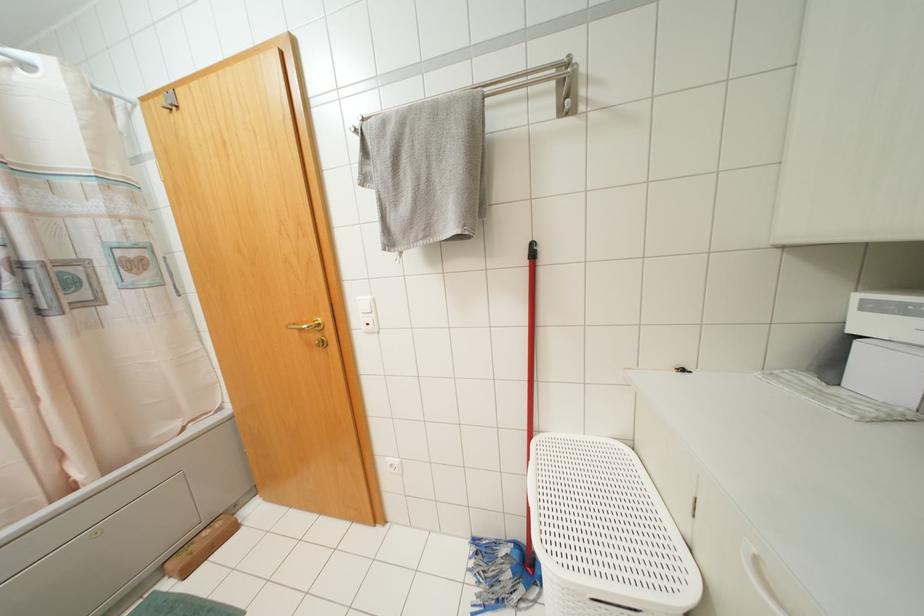
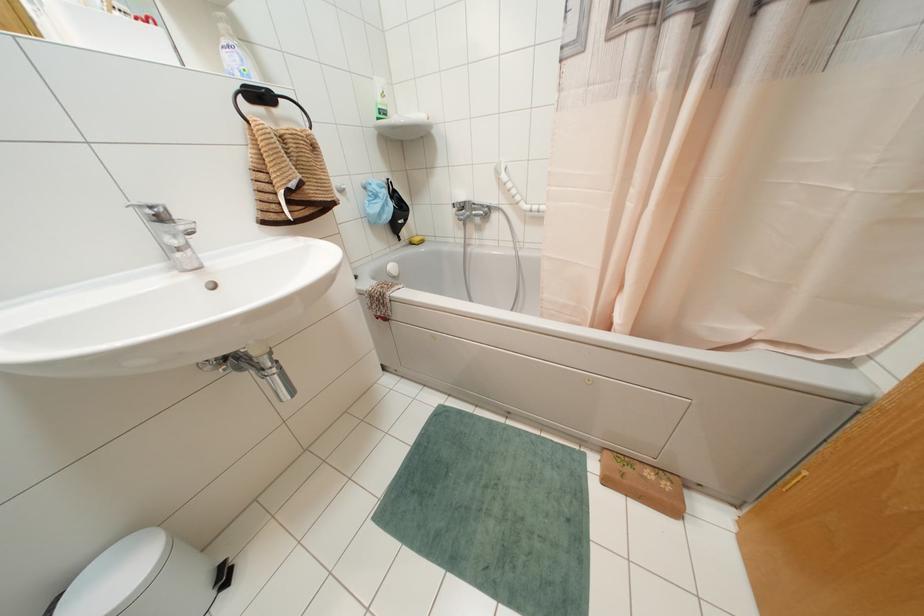
First-person continuous shooting, in which direction is the camera rotating?

The rotation direction of the camera is left-down.